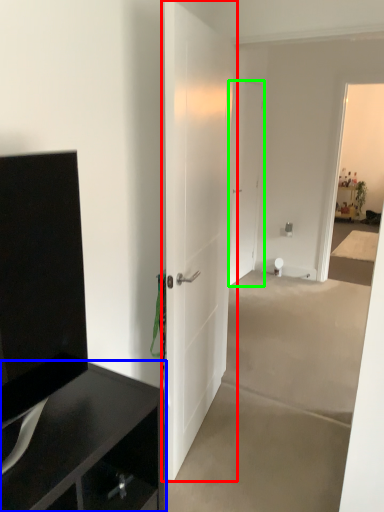
Question: Which is nearer to the door (highlighted by a red box)? cabinetry (highlighted by a blue box) or door (highlighted by a green box).

Choices:
 (A) cabinetry
 (B) door

Answer: (A)